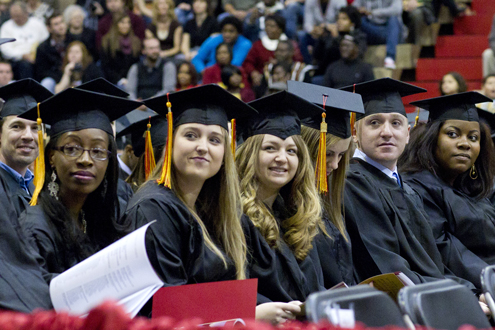
You are a GUI agent. You are given a task and a screenshot of the screen. Output one action in this format:
    pyautogui.click(x=<x>, y=<y>)
    Task: Click on the chair seats
    Image resolution: width=495 pixels, height=330 pixels.
    Given the screenshot: What is the action you would take?
    pyautogui.click(x=441, y=299), pyautogui.click(x=378, y=313), pyautogui.click(x=489, y=282)